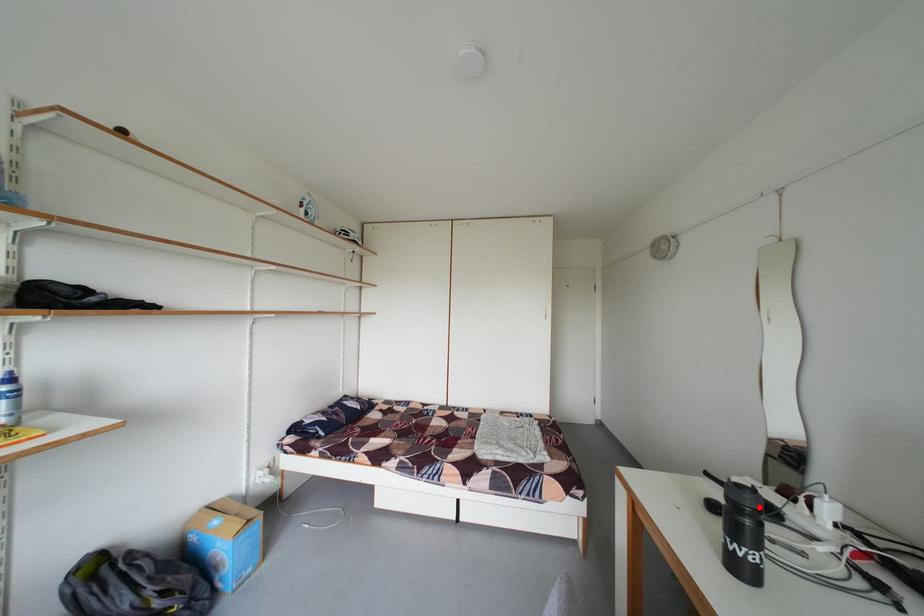
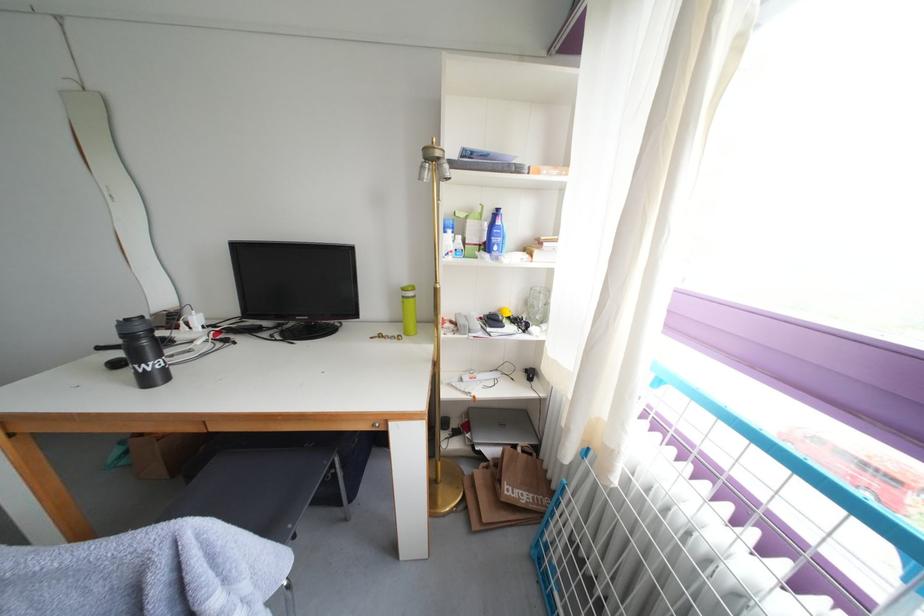
Find the pixel in the second image that matches the highlighted location in the first image.

(150, 334)